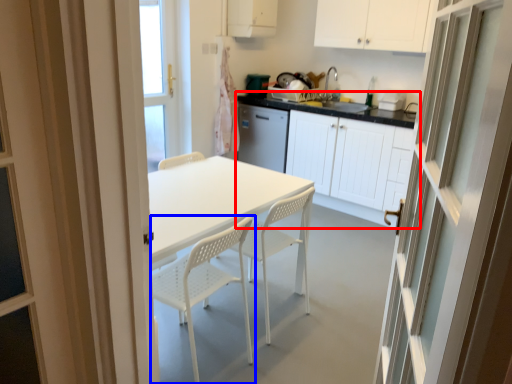
Question: Which of the following is the farthest to the observer, cabinetry (highlighted by a red box) or chair (highlighted by a blue box)?

Choices:
 (A) cabinetry
 (B) chair

Answer: (A)